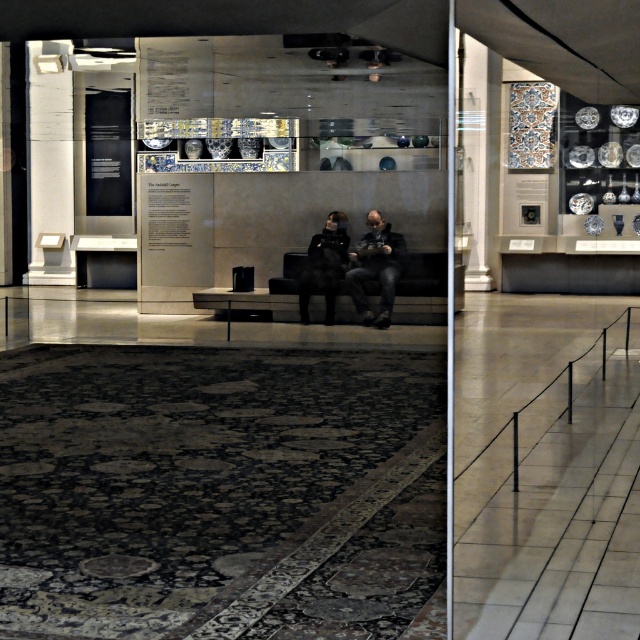
You are planning to place a 1.5 meter wide sofa in this space. You see the black leather bench at center and the wooden pillar at center. Which object should you consider when determining the available space for the sofa?

The black leather bench at center is wider than the wooden pillar at center, so you should consider the black leather bench at center when determining the available space for the sofa.

You are a tailor measuring for a custom suit. You observe the dark gray fabric jacket at center and the wooden pillar at center in the scene. Which object is wider when viewed from your current position?

The dark gray fabric jacket at center is wider than the wooden pillar at center.